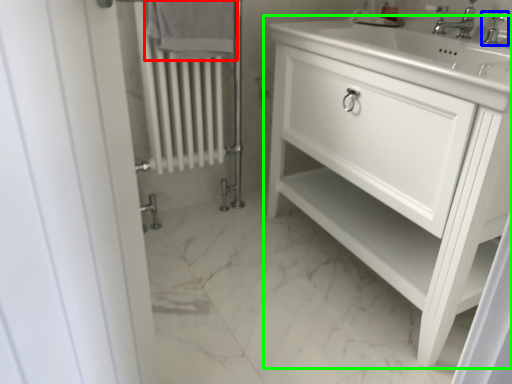
Question: Which object is positioned farthest from bath towel (highlighted by a red box)? Select from tap (highlighted by a blue box) and bathroom cabinet (highlighted by a green box).

Choices:
 (A) tap
 (B) bathroom cabinet

Answer: (A)